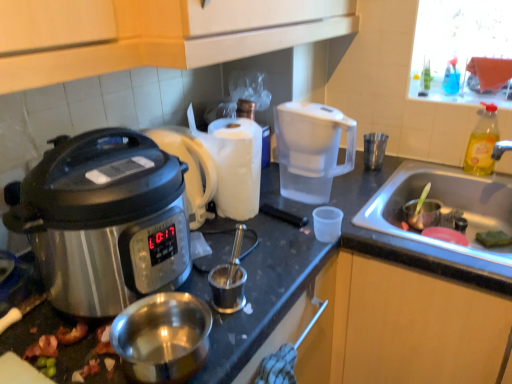
Question: From the image's perspective, is yellow translucent bottle at sink right, marked as the 2th bottle in a top-to-bottom arrangement, above or below transparent plastic water filter pitcher at center-right?

Choices:
 (A) above
 (B) below

Answer: (A)

Question: Is yellow translucent bottle at sink right, marked as the 2th bottle in a top-to-bottom arrangement, spatially inside transparent plastic water filter pitcher at center-right, or outside of it?

Choices:
 (A) outside
 (B) inside

Answer: (A)

Question: Which of these objects is positioned farthest from the stainless steel sink at lower right?

Choices:
 (A) transparent plastic cup at center, the 3th coffee cup viewed from the right
 (B) metallic silver cup at right, acting as the 1th coffee cup starting from the top
 (C) shiny silver pot at lower left
 (D) transparent plastic water filter pitcher at center-right
 (E) blue translucent bottle at upper right, marked as the second bottle in a bottom-to-top arrangement

Answer: (C)

Question: Estimate the real-world distances between objects in this image. Which object is farther from the stainless steel slow cooker at left?

Choices:
 (A) shiny metallic bacon at lower left
 (B) shiny silver pot at lower left
 (C) stainless steel sink at lower right
 (D) metallic silver cup at right, which is the 3th coffee cup from bottom to top
 (E) blue translucent bottle at upper right, the 1th bottle in the top-to-bottom sequence

Answer: (E)